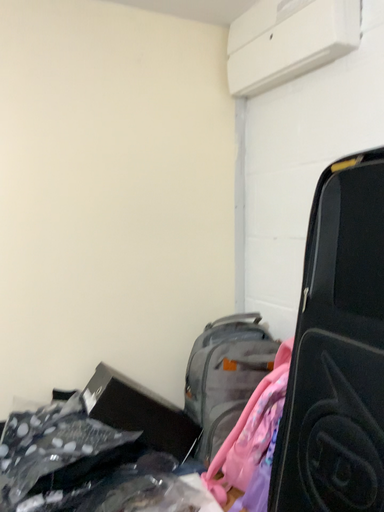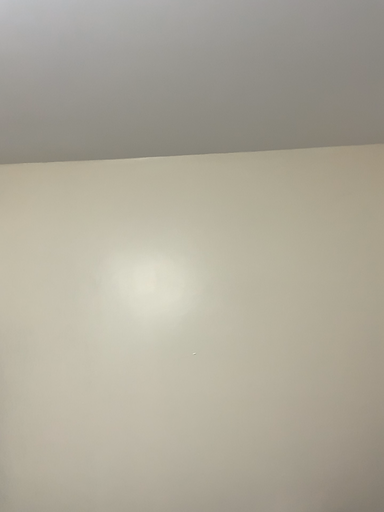
Question: How did the camera likely rotate when shooting the video?

Choices:
 (A) rotated downward
 (B) rotated upward

Answer: (B)